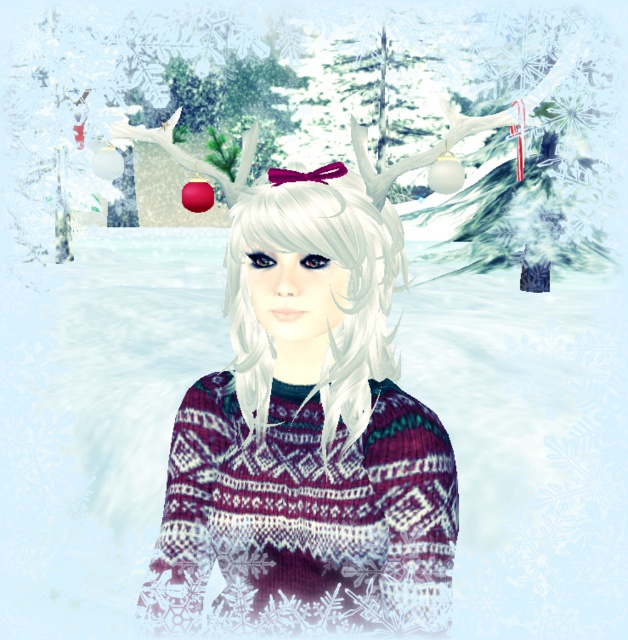
Is point (403, 448) positioned in front of point (158, 620)?

Yes, it is in front of point (158, 620).

Who is shorter, knitted sweater at center or knitted wool sweater at center?

Standing shorter between the two is knitted wool sweater at center.

This screenshot has height=640, width=628. Find the location of `knitted sweater at center`. knitted sweater at center is located at coordinates (310, 419).

Describe the element at coordinates (303, 516) in the screenshot. Image resolution: width=628 pixels, height=640 pixels. I see `knitted wool sweater at center` at that location.

Does knitted wool sweater at center have a larger size compared to white matte hair at center?

Incorrect, knitted wool sweater at center is not larger than white matte hair at center.

Which is in front, point (261, 621) or point (257, 436)?

Point (257, 436)

The height and width of the screenshot is (640, 628). Find the location of `knitted wool sweater at center`. knitted wool sweater at center is located at coordinates (303, 516).

Is point (246, 228) behind point (359, 429)?

No, (246, 228) is in front of (359, 429).

Who is positioned more to the left, knitted sweater at center or white matte hair at center?

From the viewer's perspective, knitted sweater at center appears more on the left side.

Is point (247, 408) closer to camera compared to point (311, 180)?

No, it is not.

Image resolution: width=628 pixels, height=640 pixels. I want to click on knitted sweater at center, so click(x=310, y=419).